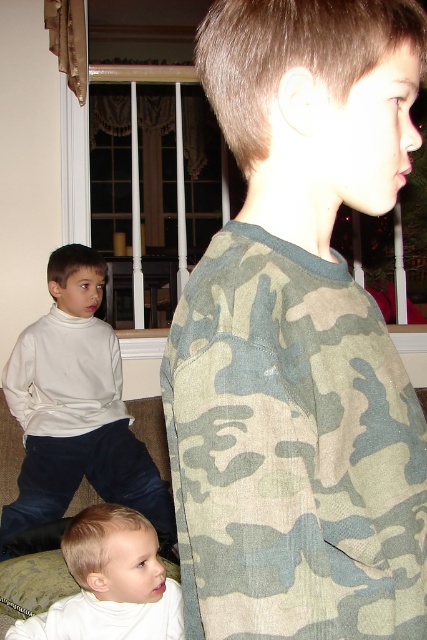
You are standing in the living room and want to find the camo fabric shirt at center. According to the coordinates provided, where should you look relative to the window?

The camo fabric shirt at center is located at coordinates point (292,451), which would be to the lower right of the window since the coordinates are measured from the bottom left corner of the image as (0,0).

You are a parent trying to pick up the white soft baby at lower left. The white turtleneck sweater at left is in the way. Can you reach the baby without moving the sweater?

The white turtleneck sweater at left is 78.39 centimeters away from the white soft baby at lower left. Since the distance is quite large, you can easily reach the baby without moving the sweater.